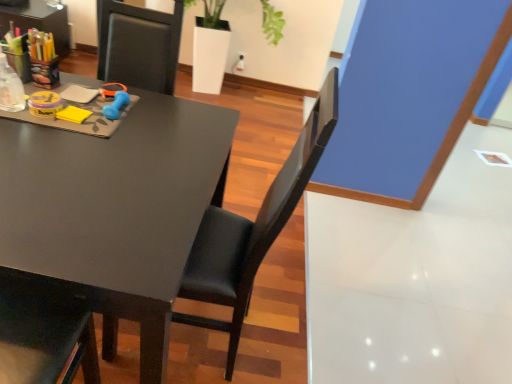
Question: Considering the positions of black leather chair at center and matte black desk at left in the image, is black leather chair at center taller or shorter than matte black desk at left?

Choices:
 (A) tall
 (B) short

Answer: (A)

Question: Is black leather chair at center in front of or behind matte black desk at left in the image?

Choices:
 (A) front
 (B) behind

Answer: (A)

Question: Which object is positioned farthest from the white glossy planter at upper center?

Choices:
 (A) matte black desk at left
 (B) blue plastic scissors at upper center
 (C) black leather chair at center

Answer: (C)

Question: Estimate the real-world distances between objects in this image. Which object is farther from the blue plastic scissors at upper center?

Choices:
 (A) matte black desk at left
 (B) white glossy planter at upper center
 (C) black leather chair at center

Answer: (B)